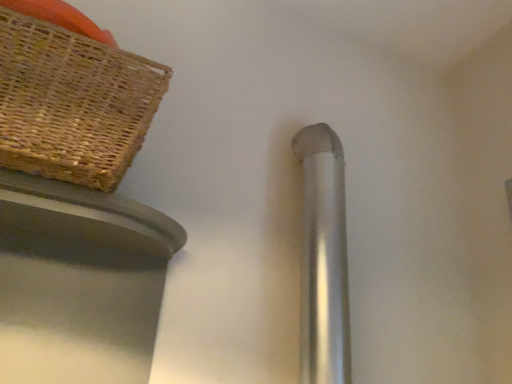
Question: From the image's perspective, relative to silver metallic door handle at center, is woven brown picnic basket at upper left above or below?

Choices:
 (A) above
 (B) below

Answer: (A)

Question: From a real-world perspective, is woven brown picnic basket at upper left positioned above or below silver metallic door handle at center?

Choices:
 (A) below
 (B) above

Answer: (B)

Question: Is point (4, 148) positioned closer to the camera than point (316, 372)?

Choices:
 (A) closer
 (B) farther

Answer: (A)

Question: From a real-world perspective, is silver metallic door handle at center positioned above or below woven brown picnic basket at upper left?

Choices:
 (A) below
 (B) above

Answer: (A)

Question: Is silver metallic door handle at center to the left or to the right of woven brown picnic basket at upper left in the image?

Choices:
 (A) left
 (B) right

Answer: (B)

Question: Looking at the image, does silver metallic door handle at center seem bigger or smaller compared to woven brown picnic basket at upper left?

Choices:
 (A) big
 (B) small

Answer: (B)

Question: Choose the correct answer: Is silver metallic door handle at center inside woven brown picnic basket at upper left or outside it?

Choices:
 (A) inside
 (B) outside

Answer: (B)